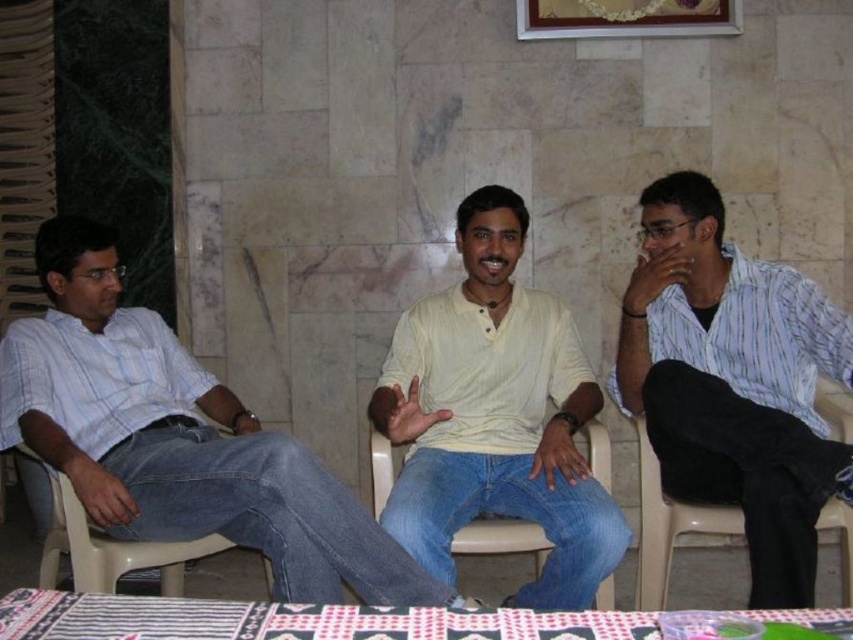
Can you confirm if white striped shirt at right is shorter than gold-framed picture at upper center?

Incorrect, white striped shirt at right's height does not fall short of gold-framed picture at upper center's.

Which is in front, point (711, 481) or point (553, 12)?

Point (711, 481)

Locate an element on the screen. This screenshot has width=853, height=640. white striped shirt at right is located at coordinates (732, 381).

Is light blue denim jeans at left closer to camera compared to plastic at right?

Yes, light blue denim jeans at left is in front of plastic at right.

Is light blue denim jeans at left further to the viewer compared to plastic at right?

No.

Which is in front, point (119, 394) or point (650, 566)?

Point (650, 566) is in front.

Where is `light blue denim jeans at left`? The image size is (853, 640). light blue denim jeans at left is located at coordinates (178, 438).

Is white striped shirt at right thinner than patterned fabric table at lower center?

Yes.

Is white striped shirt at right taller than patterned fabric table at lower center?

Yes.

Between point (784, 339) and point (152, 632), which one is positioned in front?

Point (152, 632)

This screenshot has width=853, height=640. Identify the location of white striped shirt at right. (732, 381).